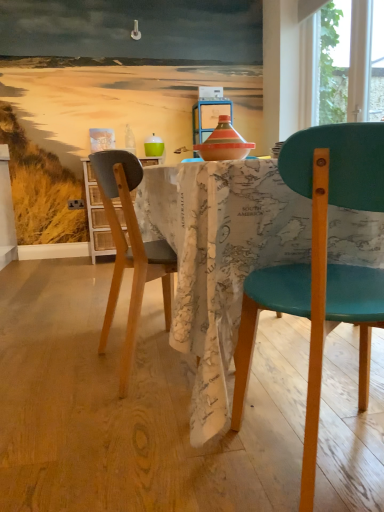
Question: From a real-world perspective, does teal plastic chair at right, which ranks as the 1th chair in right-to-left order, sit lower than translucent glass bottle at upper center?

Choices:
 (A) no
 (B) yes

Answer: (B)

Question: Does teal plastic chair at right, placed as the first chair when sorted from front to back, appear on the left side of translucent glass bottle at upper center?

Choices:
 (A) yes
 (B) no

Answer: (B)

Question: Is teal plastic chair at right, the second chair when ordered from left to right, not inside translucent glass bottle at upper center?

Choices:
 (A) no
 (B) yes

Answer: (B)

Question: Considering the relative sizes of teal plastic chair at right, placed as the first chair when sorted from front to back, and translucent glass bottle at upper center in the image provided, is teal plastic chair at right, placed as the first chair when sorted from front to back, smaller than translucent glass bottle at upper center?

Choices:
 (A) yes
 (B) no

Answer: (B)

Question: Is teal plastic chair at right, placed as the first chair when sorted from front to back, thinner than translucent glass bottle at upper center?

Choices:
 (A) yes
 (B) no

Answer: (B)

Question: Does translucent glass bottle at upper center have a greater width compared to teal plastic chair at right, the second chair when ordered from left to right?

Choices:
 (A) yes
 (B) no

Answer: (B)

Question: From the image's perspective, is translucent glass bottle at upper center under teal plastic chair at right, the second chair when ordered from left to right?

Choices:
 (A) no
 (B) yes

Answer: (A)

Question: Does translucent glass bottle at upper center have a greater height compared to teal plastic chair at right, positioned as the second chair in back-to-front order?

Choices:
 (A) yes
 (B) no

Answer: (B)

Question: Can you confirm if translucent glass bottle at upper center is bigger than teal plastic chair at right, placed as the first chair when sorted from front to back?

Choices:
 (A) no
 (B) yes

Answer: (A)

Question: Considering the relative positions of translucent glass bottle at upper center and teal plastic chair at right, placed as the first chair when sorted from front to back, in the image provided, is translucent glass bottle at upper center to the right of teal plastic chair at right, placed as the first chair when sorted from front to back, from the viewer's perspective?

Choices:
 (A) no
 (B) yes

Answer: (A)

Question: Are translucent glass bottle at upper center and teal plastic chair at right, which ranks as the 1th chair in right-to-left order, making contact?

Choices:
 (A) yes
 (B) no

Answer: (B)

Question: From the image's perspective, is map-patterned fabric at center beneath wooden cabinet at left?

Choices:
 (A) no
 (B) yes

Answer: (B)